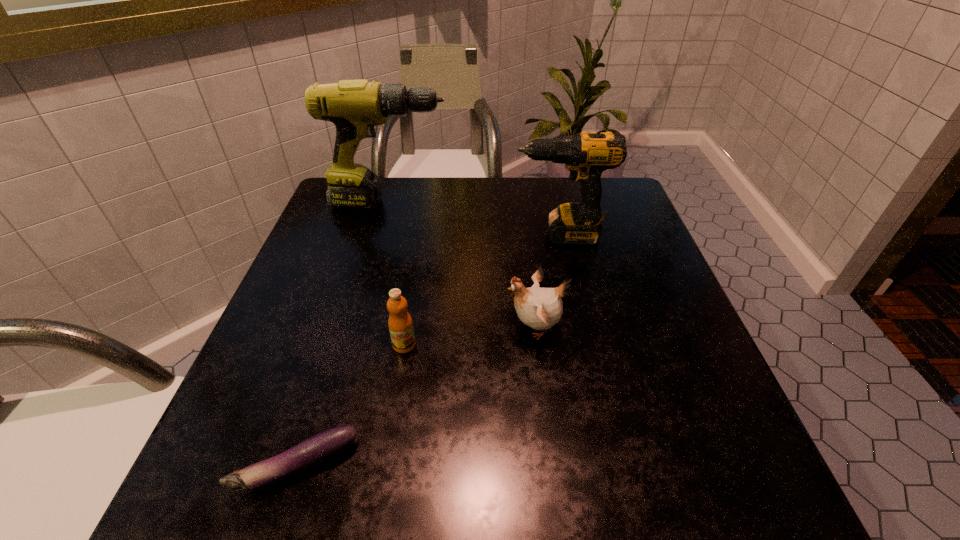
Identify which object is the second closest to the bird. Please provide its 2D coordinates. Your answer should be formatted as a tuple, i.e. [(x, y)], where the tuple contains the x and y coordinates of a point satisfying the conditions above.

[(586, 155)]

The height and width of the screenshot is (540, 960). In order to click on free point that satisfies the following two spatial constraints: 1. at the tip of the second farthest object; 2. on the front label of the orange juice in this screenshot , I will do `click(584, 345)`.

Identify the location of free space that satisfies the following two spatial constraints: 1. at the tip of the right drill; 2. on the front label of the orange juice. (584, 345).